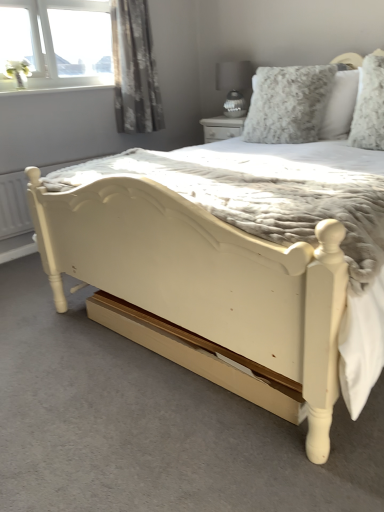
Question: Is floral gray curtain at upper left taller or shorter than fluffy white pillow at upper right, positioned as the first pillow in right-to-left order?

Choices:
 (A) short
 (B) tall

Answer: (B)

Question: Does point (137, 23) appear closer or farther from the camera than point (380, 105)?

Choices:
 (A) closer
 (B) farther

Answer: (B)

Question: Considering the real-world distances, which object is closest to the fluffy white pillow at upper right, placed as the second pillow when sorted from left to right?

Choices:
 (A) matte gray glass lamp at upper center
 (B) floral gray curtain at upper left
 (C) fluffy gray pillow at upper right, the second pillow from the right

Answer: (C)

Question: Estimate the real-world distances between objects in this image. Which object is closer to the floral gray curtain at upper left?

Choices:
 (A) fluffy white pillow at upper right, positioned as the first pillow in right-to-left order
 (B) matte gray glass lamp at upper center
 (C) fluffy gray pillow at upper right, which is counted as the 1th pillow, starting from the left

Answer: (B)